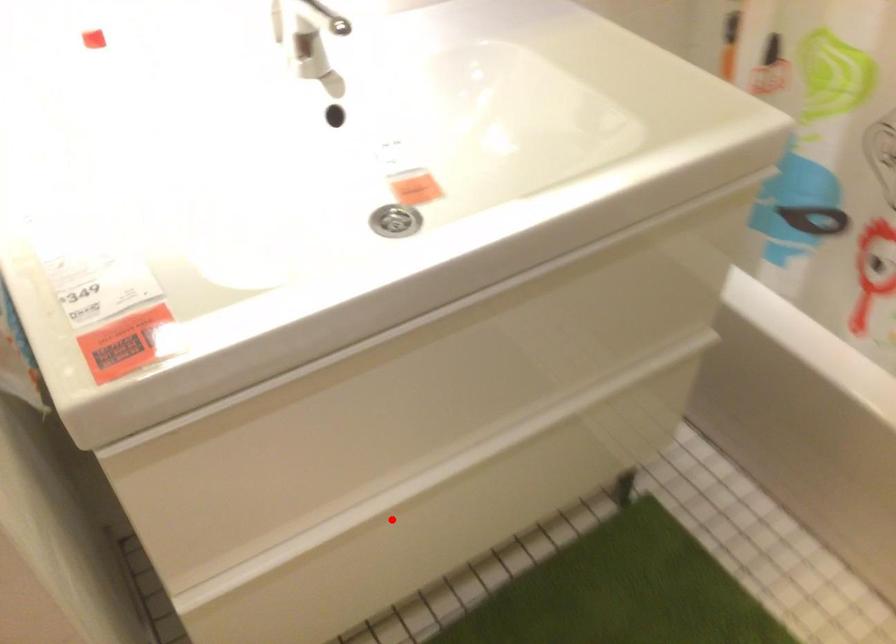
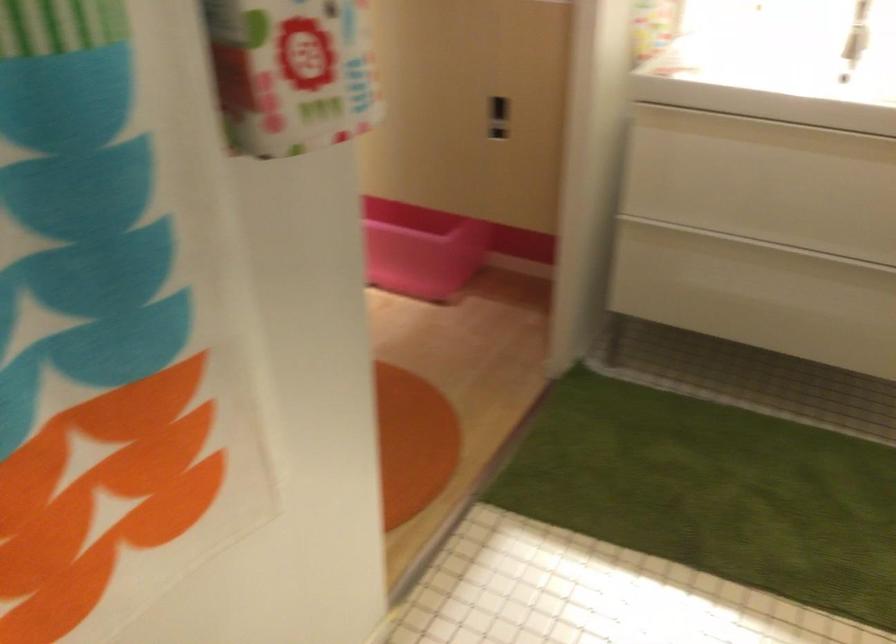
The point at the highlighted location is marked in the first image. Where is the corresponding point in the second image?

(734, 254)